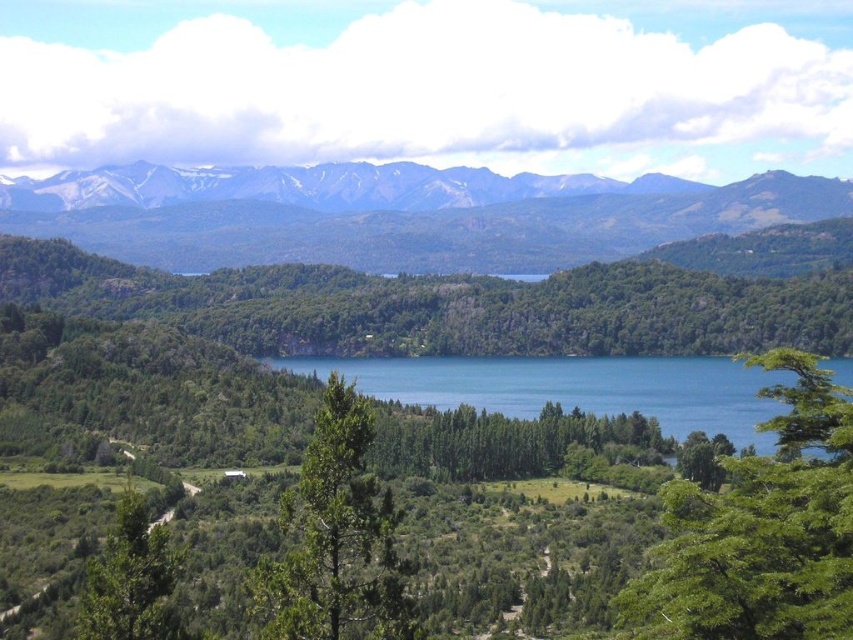
Which is in front, point (527, 404) or point (111, 538)?

Positioned in front is point (111, 538).

The height and width of the screenshot is (640, 853). What do you see at coordinates (573, 387) in the screenshot? I see `blue water at center` at bounding box center [573, 387].

You are a GUI agent. You are given a task and a screenshot of the screen. Output one action in this format:
    pyautogui.click(x=<x>, y=<y>)
    Task: Click on the blue water at center
    
    Given the screenshot: What is the action you would take?
    pyautogui.click(x=573, y=387)

What do you see at coordinates (426, 221) in the screenshot?
I see `sandy brown mountains at upper center` at bounding box center [426, 221].

Is sandy brown mountains at upper center bigger than green matte tree at center?

Indeed, sandy brown mountains at upper center has a larger size compared to green matte tree at center.

Is point (222, 262) in front of point (322, 474)?

No, it is behind (322, 474).

The image size is (853, 640). I want to click on sandy brown mountains at upper center, so click(426, 221).

What do you see at coordinates (335, 538) in the screenshot? I see `green matte tree at center` at bounding box center [335, 538].

Which is more to the left, green matte tree at center or blue water at center?

Positioned to the left is green matte tree at center.

The width and height of the screenshot is (853, 640). What do you see at coordinates (335, 538) in the screenshot? I see `green matte tree at center` at bounding box center [335, 538].

Where is `green matte tree at center`? This screenshot has width=853, height=640. green matte tree at center is located at coordinates (335, 538).